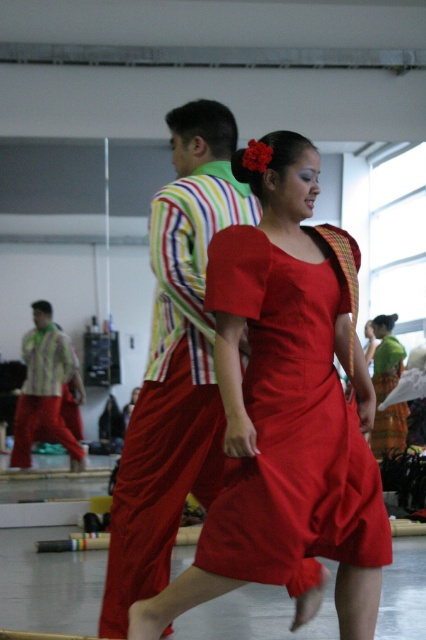
You are standing in a dance studio and want to place a small decoration exactly at the point labeled as point (255, 353). If you are currently 15 feet away from the point, how much closer do you need to move to reach it?

The distance of point (255, 353) from viewer is 11.98 feet. Since you are currently 15 feet away, you need to move 15 minus 11.98 equals 3.02 feet closer.

You are a costume designer preparing for a dance performance. You have two dresses available for the female dancer. The first is a matte red dress at center and the second is a silky green dress at lower right. Which dress would you choose if you want the shorter one for the performance?

The matte red dress at center is shorter than the silky green dress at lower right, so the matte red dress at center should be chosen for the performance.

In the dance scene, you notice the matte red dress at center and the striped cotton shirt at center. Which one is positioned more to the left side of the image?

The striped cotton shirt at center is positioned more to the left because the matte red dress at center is to the right of it.